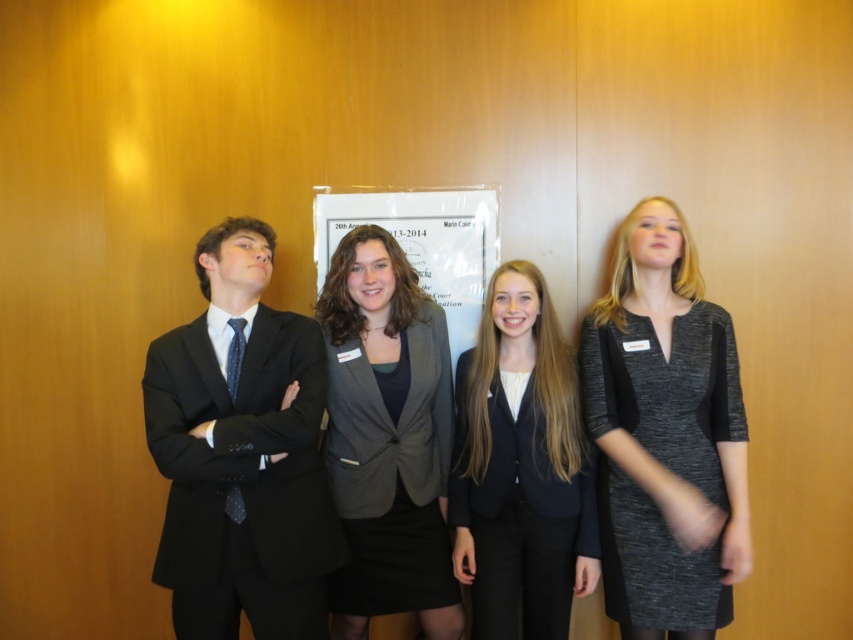
Question: Is matte black suit at left positioned before black textured dress at center?

Choices:
 (A) yes
 (B) no

Answer: (A)

Question: Which object is farther from the camera taking this photo?

Choices:
 (A) matte gray blazer at center
 (B) black textured dress at center
 (C) black matte blazer at center
 (D) matte black suit at left

Answer: (A)

Question: Does matte black suit at left have a smaller size compared to black textured dress at center?

Choices:
 (A) no
 (B) yes

Answer: (A)

Question: Among these points, which one is farthest from the camera?

Choices:
 (A) (306, 605)
 (B) (489, 541)
 (C) (680, 538)

Answer: (B)

Question: Which object appears closest to the camera in this image?

Choices:
 (A) matte black suit at left
 (B) matte gray blazer at center
 (C) black matte blazer at center

Answer: (A)

Question: Is black textured dress at center below matte gray blazer at center?

Choices:
 (A) no
 (B) yes

Answer: (A)